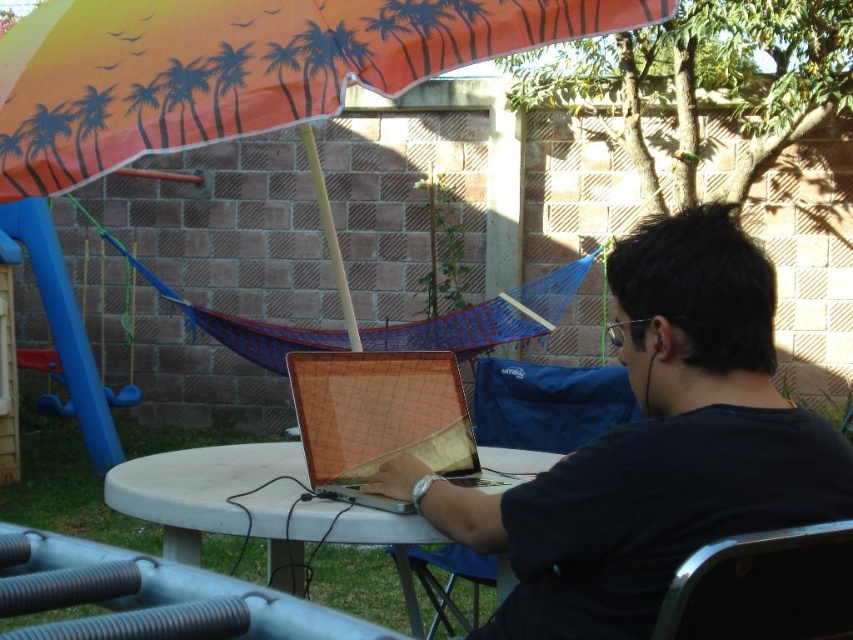
You are a photographer trying to capture the metallic silver laptop at center without the black matte shirt at center blocking the view. Is this possible given their positions?

The black matte shirt at center is in front of the metallic silver laptop at center, so it would block the view of the laptop. Adjust your angle to avoid the shirt.

You are planning to set up a shaded area for a picnic and need to know if the orange fabric umbrella at upper center can provide shade for the metallic silver chair at lower right. Based on their positions, will the umbrella cover the chair?

The orange fabric umbrella at upper center is located above the metallic silver chair at lower right, so it will provide shade for the chair.

You are standing at point (840, 561) and want to walk to point (48, 64). Is there any object between these two points that might block your path?

Point (48, 64) is behind point (840, 561), so there are no objects blocking the path between them.